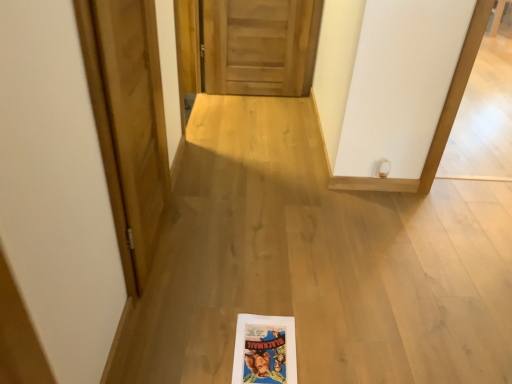
This screenshot has width=512, height=384. In order to click on unoccupied area in front of wooden door at left, which is counted as the second door, starting from the back in this screenshot , I will do 183,320.